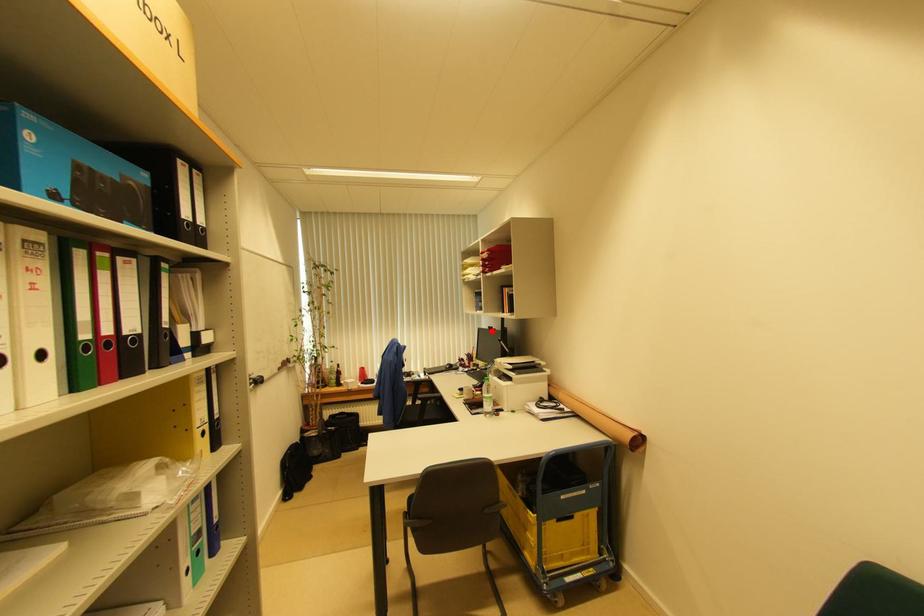
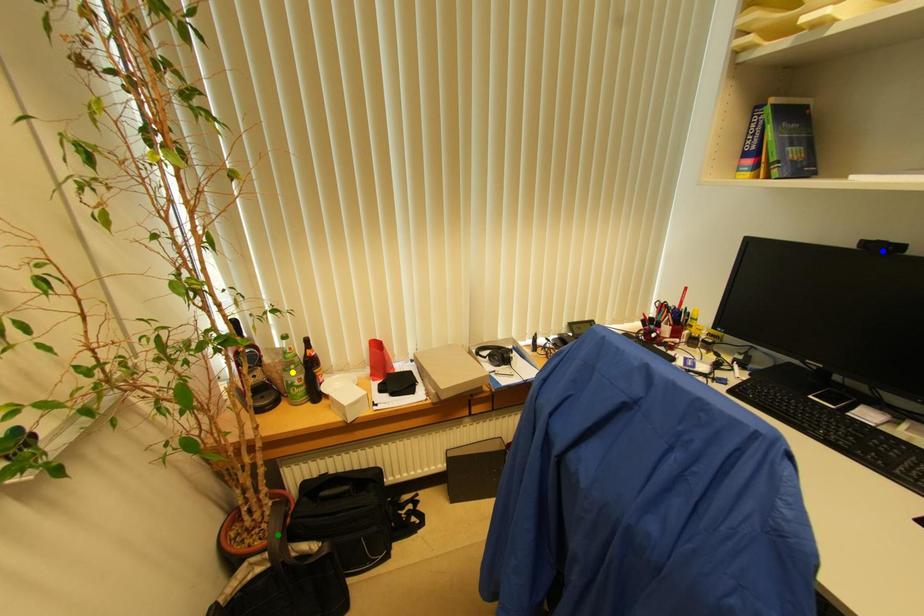
Question: I am providing you with two images of the same scene from different viewpoints. A red point is marked on the first image. You are given multiple points on the second image. Which spot in image 2 lines up with the point in image 1?

Choices:
 (A) blue point
 (B) yellow point
 (C) green point

Answer: (A)